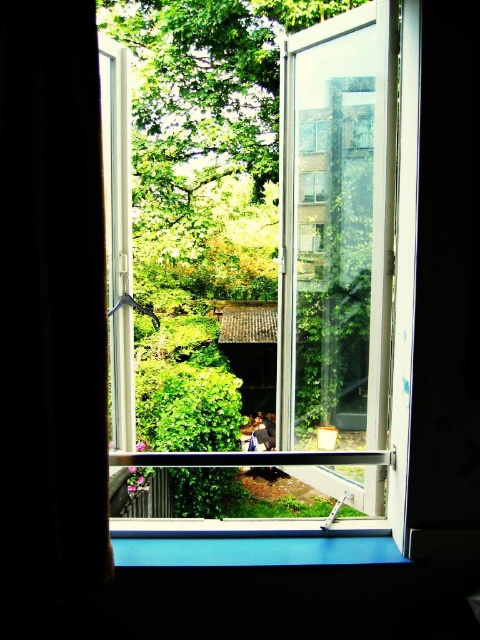
Which of these two, clear glass window at center or black fabric curtain at left, stands taller?

black fabric curtain at left

Is point (365, 525) positioned in front of point (16, 534)?

No, (365, 525) is behind (16, 534).

Measure the distance between point (339, 65) and camera.

Point (339, 65) is 2.38 meters from camera.

Image resolution: width=480 pixels, height=640 pixels. I want to click on clear glass window at center, so click(x=291, y=282).

Is clear glass window at center bigger than green leafy tree at center?

Incorrect, clear glass window at center is not larger than green leafy tree at center.

Can you confirm if clear glass window at center is positioned below green leafy tree at center?

Yes.

Where is `clear glass window at center`? clear glass window at center is located at coordinates (291, 282).

Can you confirm if black fabric curtain at left is taller than green leafy tree at center?

No, black fabric curtain at left is not taller than green leafy tree at center.

Between point (8, 76) and point (229, 52), which one is positioned behind?

The point (229, 52) is more distant.

Between point (1, 356) and point (240, 4), which one is positioned in front?

Point (1, 356) is more forward.

This screenshot has width=480, height=640. I want to click on black fabric curtain at left, so click(x=51, y=324).